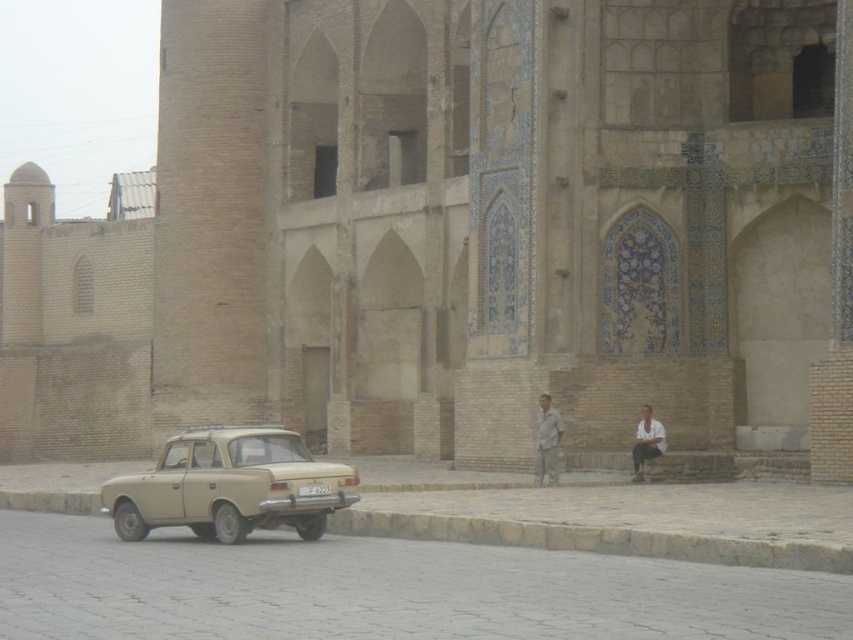
Question: Does beige matte car at lower left appear over white cotton shirt at lower right?

Choices:
 (A) no
 (B) yes

Answer: (A)

Question: Observing the image, what is the correct spatial positioning of beige matte car at lower left in reference to light brown fabric shirt at lower center?

Choices:
 (A) below
 (B) above

Answer: (A)

Question: Which of the following is the farthest from the observer?

Choices:
 (A) (215, 426)
 (B) (645, 452)
 (C) (364, 524)
 (D) (479, 548)

Answer: (A)

Question: Considering the real-world distances, which object is closest to the smooth stone pavement at lower center?

Choices:
 (A) light brown fabric shirt at lower center
 (B) white cotton shirt at lower right
 (C) brown stone curb at lower center

Answer: (C)

Question: Which point appears farthest from the camera in this image?

Choices:
 (A) (457, 522)
 (B) (337, 499)
 (C) (537, 458)

Answer: (C)

Question: Is smooth stone pavement at lower center above beige matte car at lower left?

Choices:
 (A) no
 (B) yes

Answer: (B)